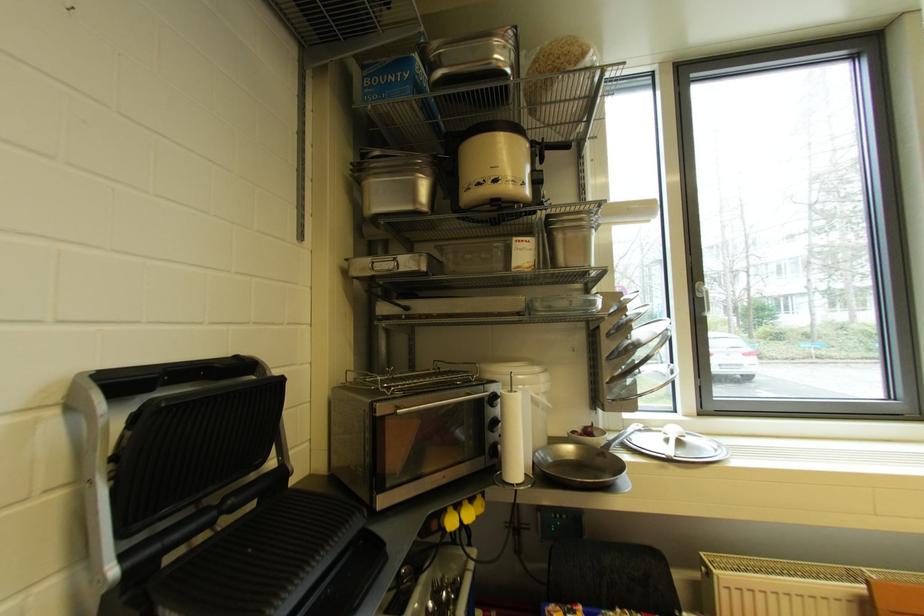
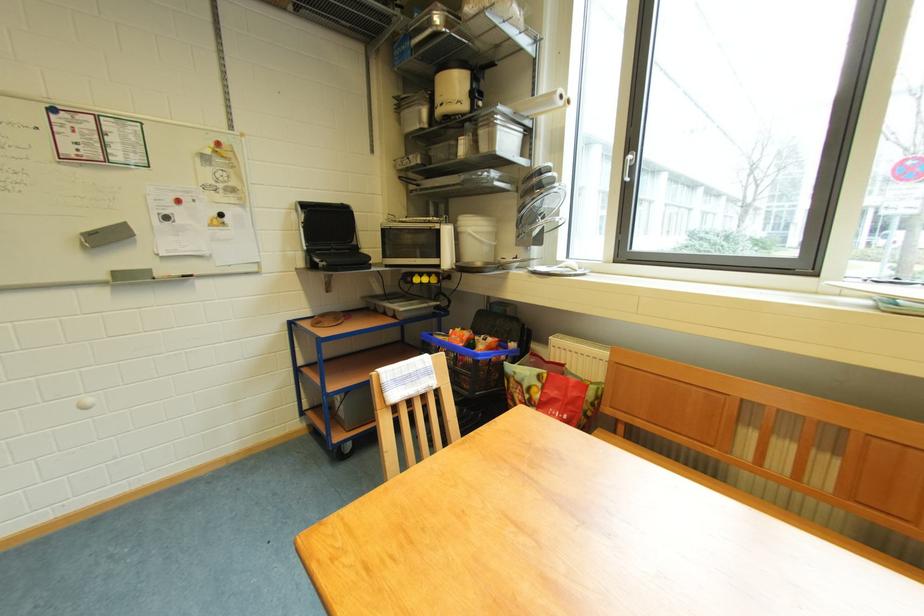
Find the pixel in the second image that matches pixel 79 411 in the first image.

(305, 214)